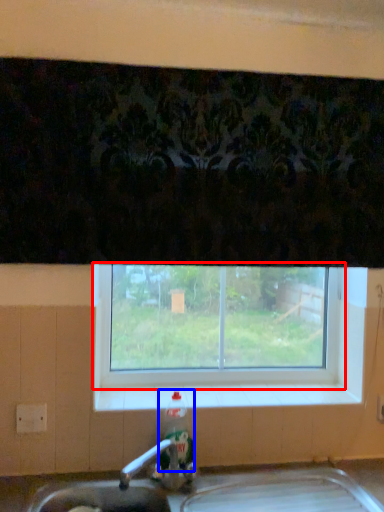
Question: Which object appears closest to the camera in this image, window (highlighted by a red box) or bottle (highlighted by a blue box)?

Choices:
 (A) window
 (B) bottle

Answer: (B)